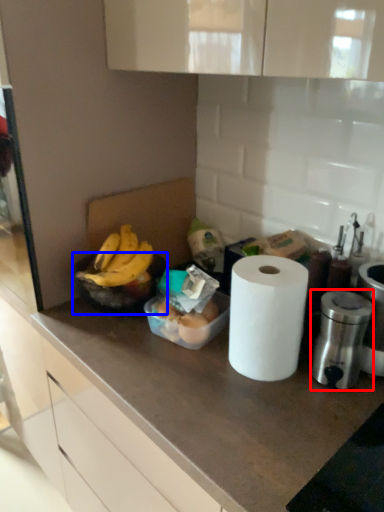
Question: Which of the following is the closest to the observer, appliance (highlighted by a red box) or bowl (highlighted by a blue box)?

Choices:
 (A) appliance
 (B) bowl

Answer: (A)